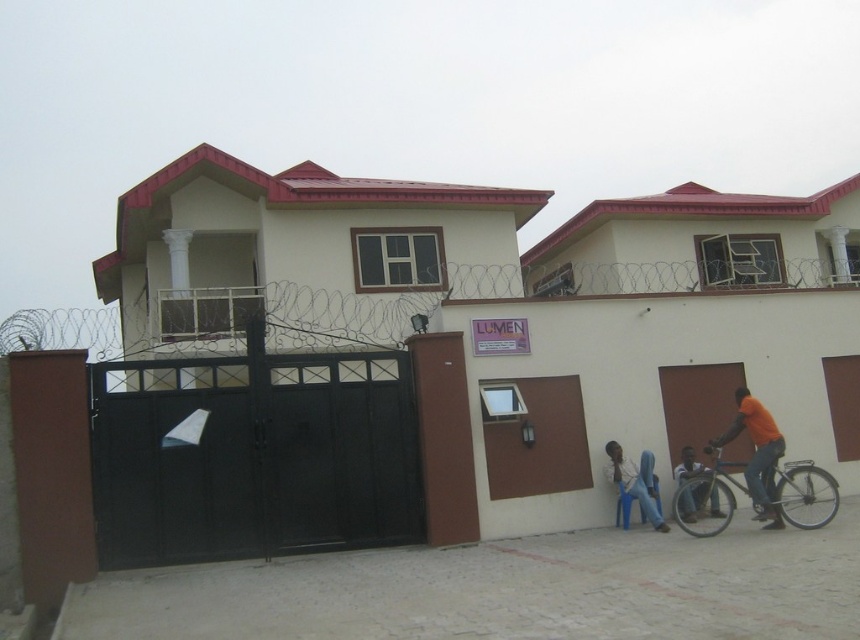
Can you confirm if blue metallic bicycle at lower right is positioned to the left of light blue plastic chair at lower right?

In fact, blue metallic bicycle at lower right is to the right of light blue plastic chair at lower right.

This screenshot has width=860, height=640. Find the location of `blue metallic bicycle at lower right`. blue metallic bicycle at lower right is located at coordinates (802, 493).

Is point (794, 474) behind point (643, 472)?

No, (794, 474) is closer to viewer.

This screenshot has width=860, height=640. In order to click on blue metallic bicycle at lower right in this screenshot , I will do `click(802, 493)`.

Who is more distant from viewer, (x=797, y=502) or (x=752, y=426)?

Point (x=797, y=502)

Which of these two, blue metallic bicycle at lower right or orange cotton shirt at right, stands shorter?

blue metallic bicycle at lower right

Is point (808, 508) more distant than point (771, 420)?

That is True.

You are a GUI agent. You are given a task and a screenshot of the screen. Output one action in this format:
    pyautogui.click(x=<x>, y=<y>)
    Task: Click on the blue metallic bicycle at lower right
    The height and width of the screenshot is (640, 860).
    Given the screenshot: What is the action you would take?
    pyautogui.click(x=802, y=493)

Can you confirm if light blue plastic chair at lower right is thinner than orange shirt at lower right?

Indeed, light blue plastic chair at lower right has a lesser width compared to orange shirt at lower right.

Is point (656, 506) in front of point (685, 458)?

Yes, it is.

Where is `light blue plastic chair at lower right`? Image resolution: width=860 pixels, height=640 pixels. light blue plastic chair at lower right is located at coordinates (636, 483).